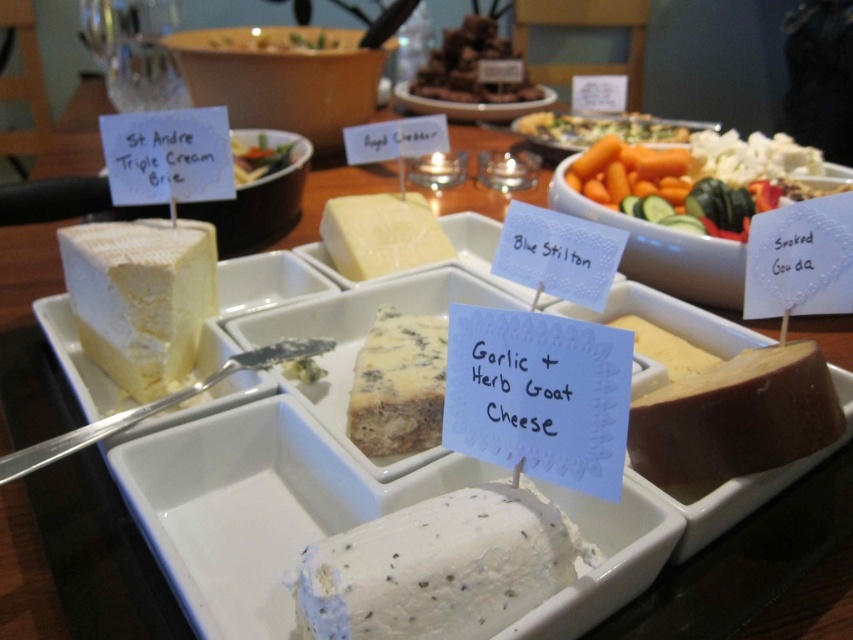
Does brown smooth smoked gouda at right appear under white creamy cheese at upper right?

Correct, brown smooth smoked gouda at right is located below white creamy cheese at upper right.

Does brown smooth smoked gouda at right appear on the left side of white creamy cheese at upper right?

Yes, brown smooth smoked gouda at right is to the left of white creamy cheese at upper right.

At what (x,y) coordinates should I click in order to perform the action: click on brown smooth smoked gouda at right. Please return your answer as a coordinate pair (x, y). Looking at the image, I should click on (735, 417).

You are a GUI agent. You are given a task and a screenshot of the screen. Output one action in this format:
    pyautogui.click(x=<x>, y=<y>)
    Task: Click on the brown smooth smoked gouda at right
    This screenshot has width=853, height=640.
    Given the screenshot: What is the action you would take?
    pyautogui.click(x=735, y=417)

Does dark chocolate cake at upper center have a larger size compared to white creamy cheese at upper right?

Yes, dark chocolate cake at upper center is bigger than white creamy cheese at upper right.

Who is positioned more to the right, dark chocolate cake at upper center or white creamy cheese at upper right?

Positioned to the right is white creamy cheese at upper right.

I want to click on dark chocolate cake at upper center, so click(473, 67).

Can you confirm if blue crumbly garlic + herb goat cheese at center is smaller than green leafy vegetable at center?

Indeed, blue crumbly garlic + herb goat cheese at center has a smaller size compared to green leafy vegetable at center.

Is point (355, 444) positioned in front of point (231, 152)?

Yes, it is.

Find the location of `blue crumbly garlic + herb goat cheese at center`. blue crumbly garlic + herb goat cheese at center is located at coordinates (398, 385).